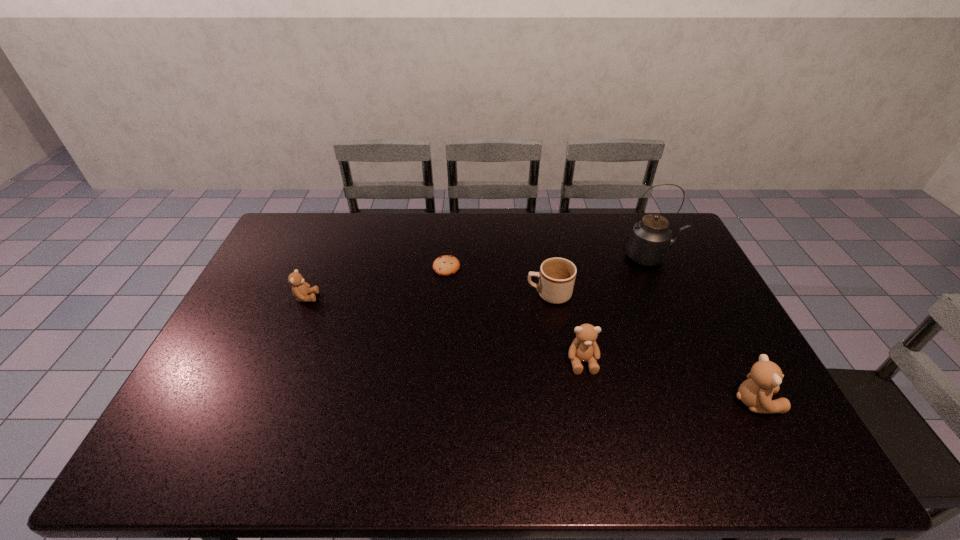
The image size is (960, 540). Find the location of `kettle that is at the right edge`. kettle that is at the right edge is located at coordinates (650, 239).

You are a GUI agent. You are given a task and a screenshot of the screen. Output one action in this format:
    pyautogui.click(x=<x>, y=<y>)
    Task: Click on the object present at the far right corner
    
    Given the screenshot: What is the action you would take?
    pyautogui.click(x=650, y=239)

Identify the location of object that is at the near right corner. (763, 381).

What are the coordinates of `vacant space at the far edge of the desktop` in the screenshot? It's located at (333, 230).

At what (x,y) coordinates should I click in order to perform the action: click on free space at the near edge. Please return your answer as a coordinate pair (x, y). Looking at the image, I should click on (644, 411).

The image size is (960, 540). In order to click on vacant space at the left edge of the desktop in this screenshot , I will do [x=226, y=335].

Where is `vacant space at the right edge`? This screenshot has width=960, height=540. vacant space at the right edge is located at coordinates (686, 334).

This screenshot has width=960, height=540. In the image, there is a desktop. Identify the location of free space at the far left corner. (294, 248).

At what (x,y) coordinates should I click in order to perform the action: click on free space at the near left corner of the desktop. Please return your answer as a coordinate pair (x, y). The width and height of the screenshot is (960, 540). Looking at the image, I should click on (172, 421).

At what (x,y) coordinates should I click in order to perform the action: click on empty space between the second nearest object and the leftmost teddy bear. Please return your answer as a coordinate pair (x, y). The height and width of the screenshot is (540, 960). Looking at the image, I should click on (444, 329).